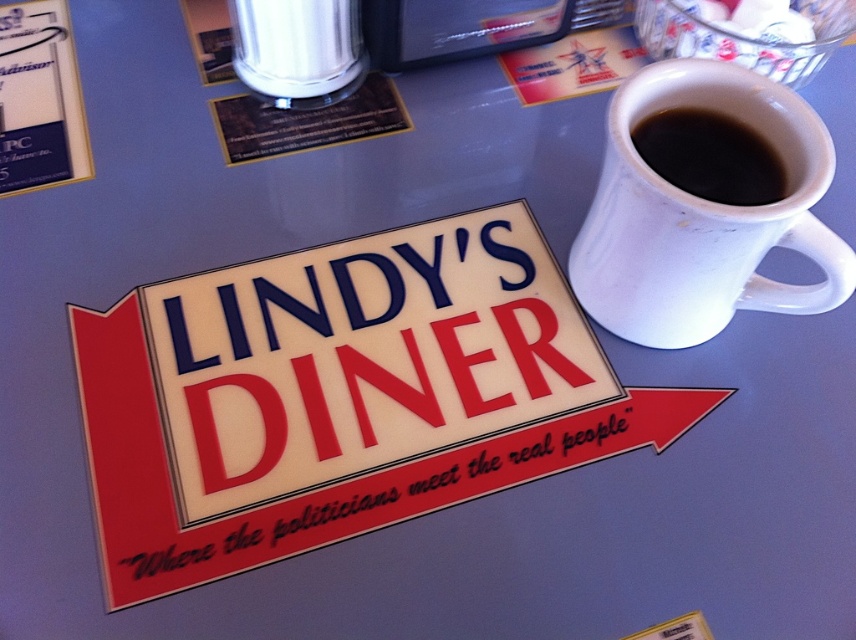
You are a customer at Lindy s Diner and you want to grab the white matte mug at upper right. Which direction should you move your hand relative to the black matte mug at upper right to reach it?

The white matte mug at upper right is below the black matte mug at upper right, so you should move your hand downward from the black matte mug at upper right to reach the white matte mug at upper right.

You are a customer at Lindy s Diner and need to choose between the white matte mug at upper right and the black matte mug at upper right. Which mug has a larger diameter?

The white matte mug at upper right has a larger diameter than the black matte mug at upper right according to the description.